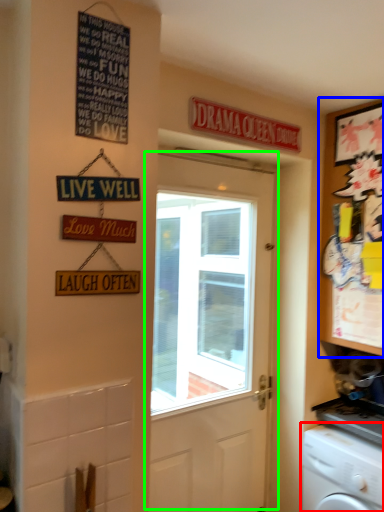
Question: Based on their relative distances, which object is nearer to washing machine (highlighted by a red box)? Choose from cabinetry (highlighted by a blue box) and door (highlighted by a green box).

Choices:
 (A) cabinetry
 (B) door

Answer: (A)